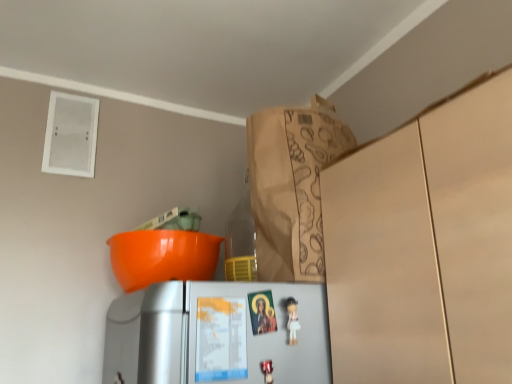
Question: Is white matte refrigerator at lower center closer to camera compared to white glossy figurine at center?

Choices:
 (A) yes
 (B) no

Answer: (A)

Question: Are white matte refrigerator at lower center and white glossy figurine at center located far from each other?

Choices:
 (A) yes
 (B) no

Answer: (B)

Question: Could you tell me if white matte refrigerator at lower center is turned towards white glossy figurine at center?

Choices:
 (A) yes
 (B) no

Answer: (A)

Question: Can you confirm if white matte refrigerator at lower center is bigger than white glossy figurine at center?

Choices:
 (A) yes
 (B) no

Answer: (A)

Question: Is the surface of white matte refrigerator at lower center in direct contact with white glossy figurine at center?

Choices:
 (A) no
 (B) yes

Answer: (A)

Question: Could white glossy figurine at center be considered to be inside white matte refrigerator at lower center?

Choices:
 (A) yes
 (B) no

Answer: (A)

Question: Considering the relative sizes of brown paper bag at upper center and white glossy figurine at center in the image provided, is brown paper bag at upper center shorter than white glossy figurine at center?

Choices:
 (A) no
 (B) yes

Answer: (A)

Question: Is brown paper bag at upper center located outside white glossy figurine at center?

Choices:
 (A) no
 (B) yes

Answer: (B)

Question: Considering the relative sizes of brown paper bag at upper center and white glossy figurine at center in the image provided, is brown paper bag at upper center thinner than white glossy figurine at center?

Choices:
 (A) yes
 (B) no

Answer: (B)

Question: Is brown paper bag at upper center closer to camera compared to white glossy figurine at center?

Choices:
 (A) yes
 (B) no

Answer: (B)

Question: From the image's perspective, is brown paper bag at upper center on top of white glossy figurine at center?

Choices:
 (A) no
 (B) yes

Answer: (B)

Question: Is brown paper bag at upper center oriented towards white glossy figurine at center?

Choices:
 (A) yes
 (B) no

Answer: (B)

Question: Does white matte refrigerator at lower center have a lesser width compared to brown paper bag at upper center?

Choices:
 (A) no
 (B) yes

Answer: (B)